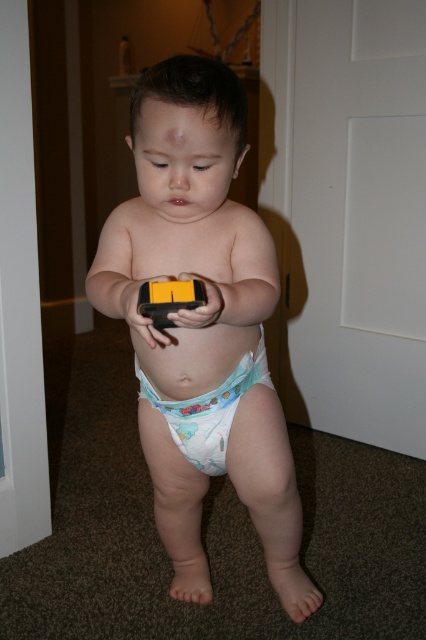
You are a parent standing in the room where the child is holding the white fabric diaper at center. You want to hand the child a pacifier that is on the table behind you. To do this, you need to step forward to reach the child. How many steps forward do you need to take if each step covers 0.75 meters?

The white fabric diaper at center is 1.13 meters away from the viewer. Since each step covers 0.75 meters, you would need to take 2 steps forward to reach the child, as 0.75 meters multiplied by 2 equals 1.5 meters, which exceeds the distance of 1.13 meters.

You are a parent trying to determine which diaper to use for your child. Both the white cloth diaper at center and the white fabric diaper at center are available. Based on their positions in the image, which one is more accessible to you?

The white cloth diaper at center is closer to the viewer than the white fabric diaper at center, so it is more accessible.